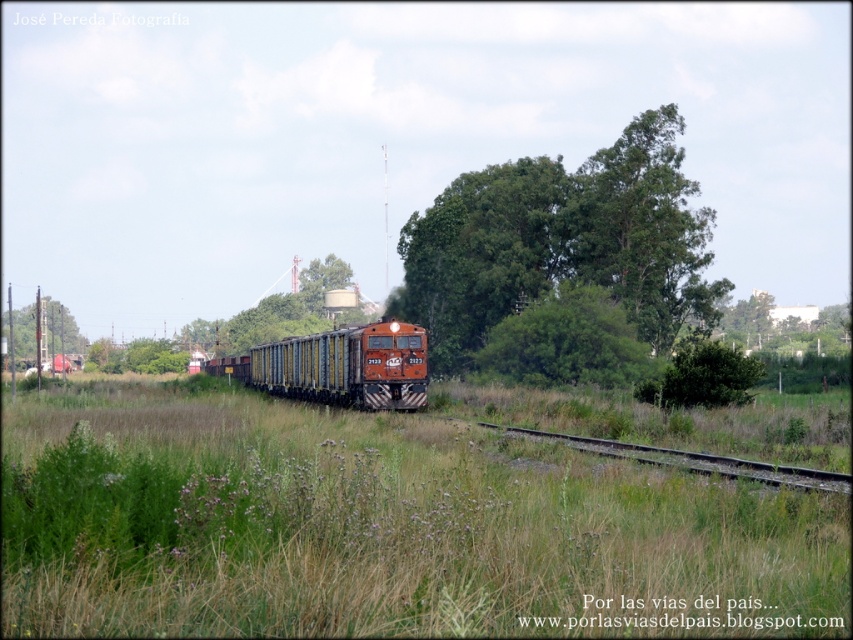
You are standing on the train tracks and see two points ahead. The first point is at coordinate point(563, 502) and the second point is at coordinate point(361, 355). Which point is closer to you?

Point(563, 502) is closer to the viewer than point(361, 355).

You are a passenger on the orange matte train at center and want to look out the window to see the green leafy tree at center. In which direction should you look?

The green leafy tree at center is to the right of the orange matte train at center, so you should look to your right to see it.